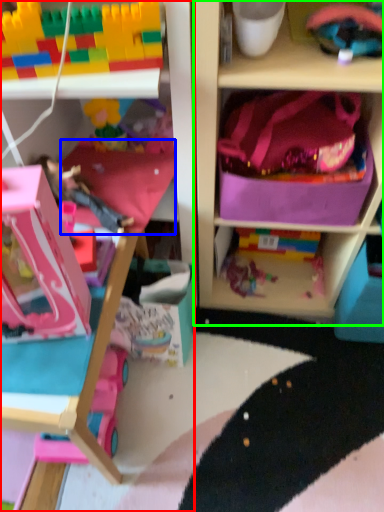
Question: Which is nearer to the cabinetry (highlighted by a red box)? pillow (highlighted by a blue box) or shelf (highlighted by a green box).

Choices:
 (A) pillow
 (B) shelf

Answer: (A)